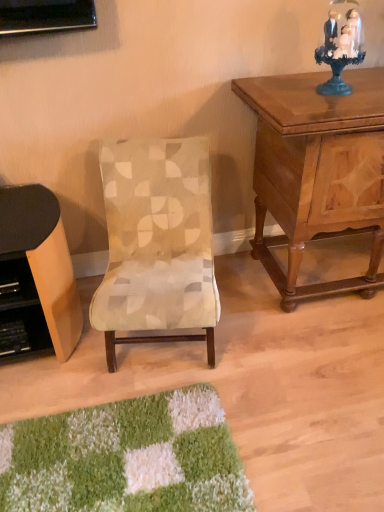
Locate an element on the screen. This screenshot has width=384, height=512. free location to the right of blue glass figurine at upper right is located at coordinates (368, 88).